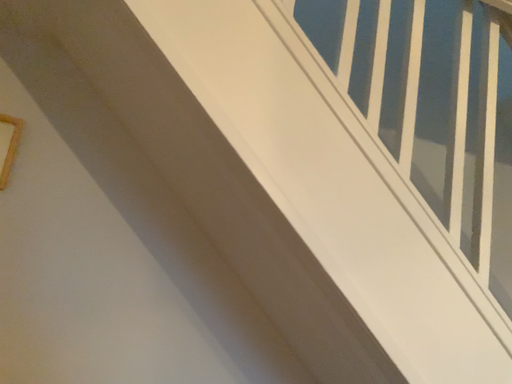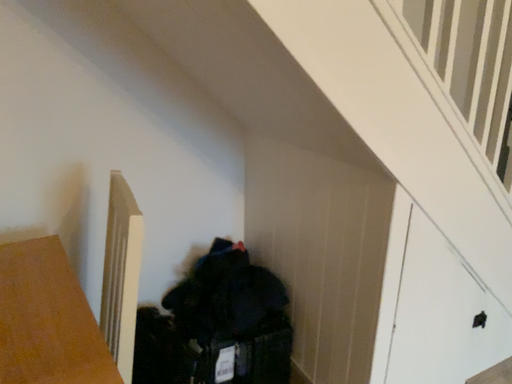
Question: How did the camera likely rotate when shooting the video?

Choices:
 (A) rotated right
 (B) rotated left

Answer: (A)